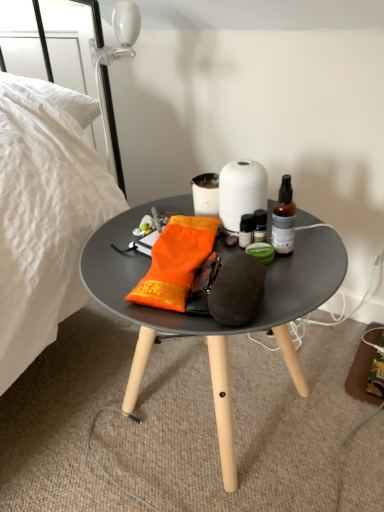
Where is `vacant space to the right of orange fabric pouch at center`? vacant space to the right of orange fabric pouch at center is located at coordinates (277, 269).